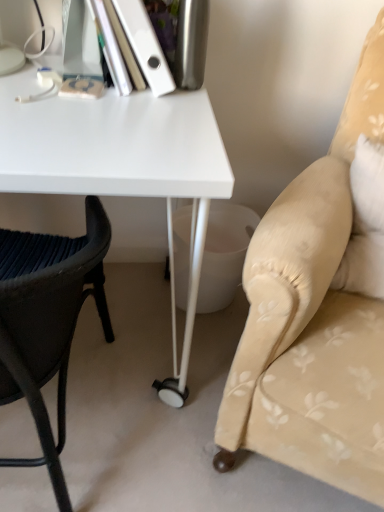
Question: From a real-world perspective, does white glossy desk at center sit lower than beige fabric cushion at right, acting as the first chair starting from the right?

Choices:
 (A) yes
 (B) no

Answer: (A)

Question: Is white glossy desk at center touching beige fabric cushion at right, acting as the first chair starting from the right?

Choices:
 (A) yes
 (B) no

Answer: (B)

Question: From the image's perspective, is white glossy desk at center located beneath beige fabric cushion at right, acting as the first chair starting from the right?

Choices:
 (A) no
 (B) yes

Answer: (A)

Question: Is white glossy desk at center at the left side of beige fabric cushion at right, acting as the first chair starting from the right?

Choices:
 (A) yes
 (B) no

Answer: (A)

Question: Considering the relative sizes of white glossy desk at center and beige fabric cushion at right, acting as the first chair starting from the right, in the image provided, is white glossy desk at center bigger than beige fabric cushion at right, acting as the first chair starting from the right,?

Choices:
 (A) yes
 (B) no

Answer: (B)

Question: Would you say white glossy desk at center is outside beige fabric cushion at right, acting as the first chair starting from the right?

Choices:
 (A) no
 (B) yes

Answer: (B)

Question: Does white glossy desk at center appear on the right side of white matte book at upper left?

Choices:
 (A) no
 (B) yes

Answer: (A)

Question: Does white glossy desk at center lie in front of white matte book at upper left?

Choices:
 (A) no
 (B) yes

Answer: (B)

Question: Does white glossy desk at center have a lesser height compared to white matte book at upper left?

Choices:
 (A) yes
 (B) no

Answer: (B)

Question: Is white glossy desk at center looking in the opposite direction of white matte book at upper left?

Choices:
 (A) no
 (B) yes

Answer: (A)

Question: Does white glossy desk at center have a larger size compared to white matte book at upper left?

Choices:
 (A) no
 (B) yes

Answer: (B)

Question: From the image's perspective, would you say white glossy desk at center is shown under white matte book at upper left?

Choices:
 (A) yes
 (B) no

Answer: (A)

Question: From the image's perspective, is white matte book at upper left on beige fabric cushion at right, acting as the first chair starting from the right?

Choices:
 (A) no
 (B) yes

Answer: (B)